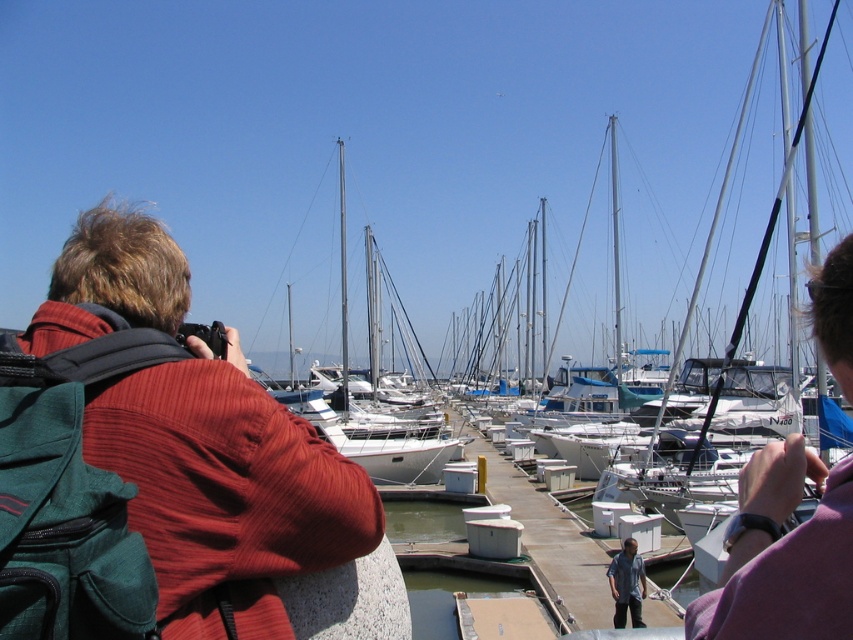
Question: Is red fabric jacket at left wider than denim shirt at lower center?

Choices:
 (A) no
 (B) yes

Answer: (B)

Question: Can you confirm if red fabric jacket at left is smaller than denim shirt at lower center?

Choices:
 (A) yes
 (B) no

Answer: (B)

Question: Which of the following is the closest to the observer?

Choices:
 (A) red fabric jacket at left
 (B) denim shirt at lower center

Answer: (A)

Question: Is red fabric jacket at left closer to camera compared to denim shirt at lower center?

Choices:
 (A) no
 (B) yes

Answer: (B)

Question: Which object is farther from the camera taking this photo?

Choices:
 (A) red fabric jacket at left
 (B) denim shirt at lower center

Answer: (B)